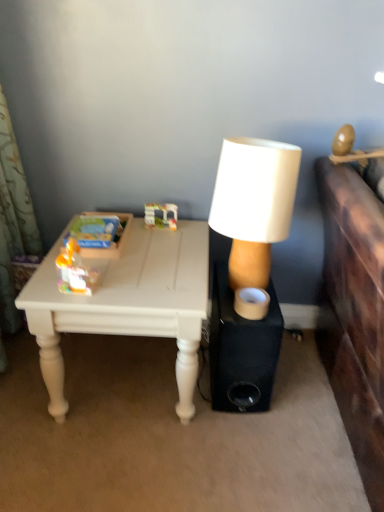
Find the location of a particular element. The image size is (384, 512). vacant area that is in front of translucent plastic toy at center, arranged as the first toy when viewed from the right is located at coordinates (158, 245).